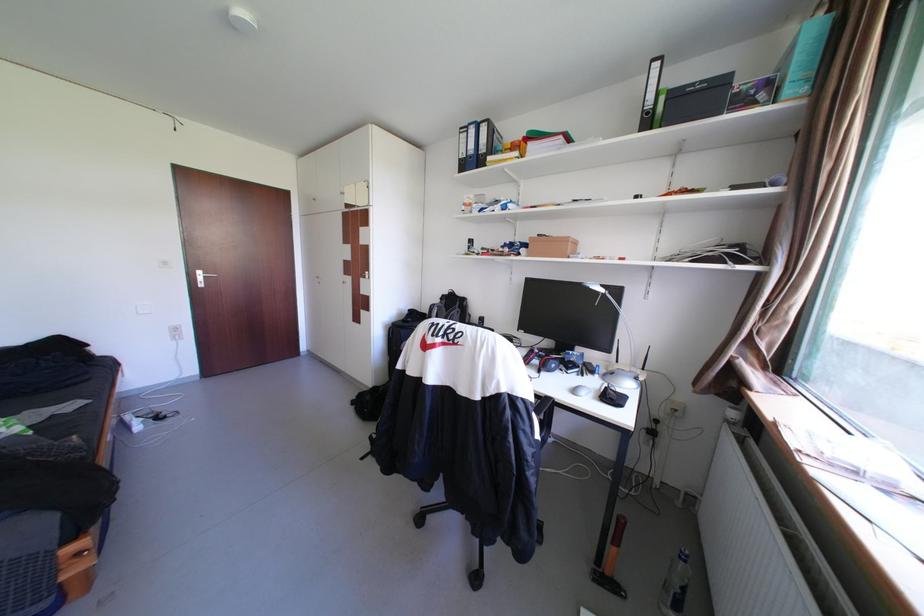
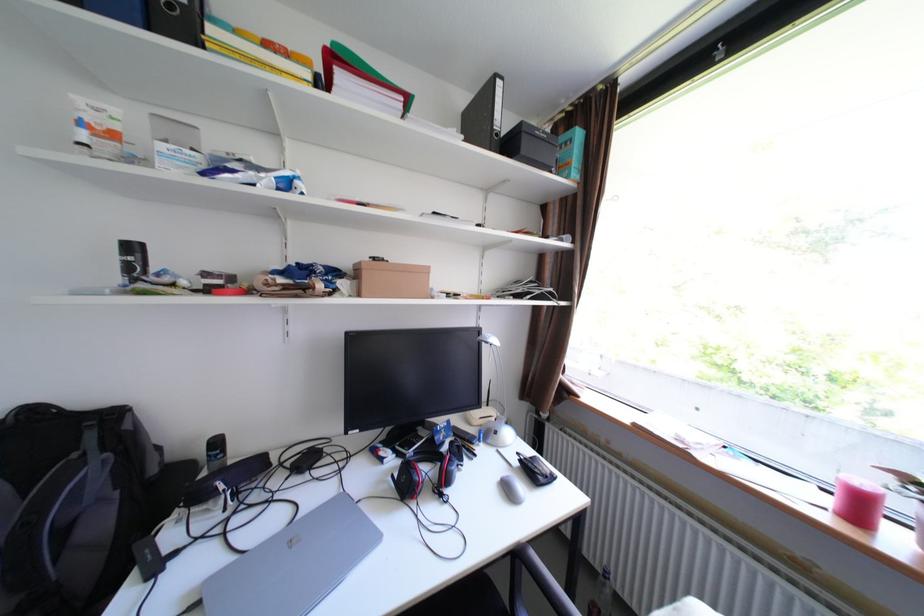
Locate, in the second image, the point that corresponds to point 541,146 in the first image.

(351, 76)